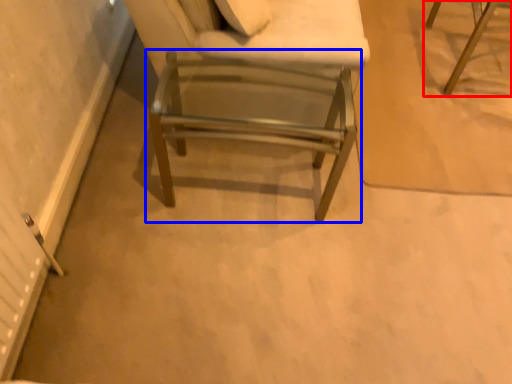
Question: Among these objects, which one is farthest to the camera, chair (highlighted by a red box) or chair (highlighted by a blue box)?

Choices:
 (A) chair
 (B) chair

Answer: (A)